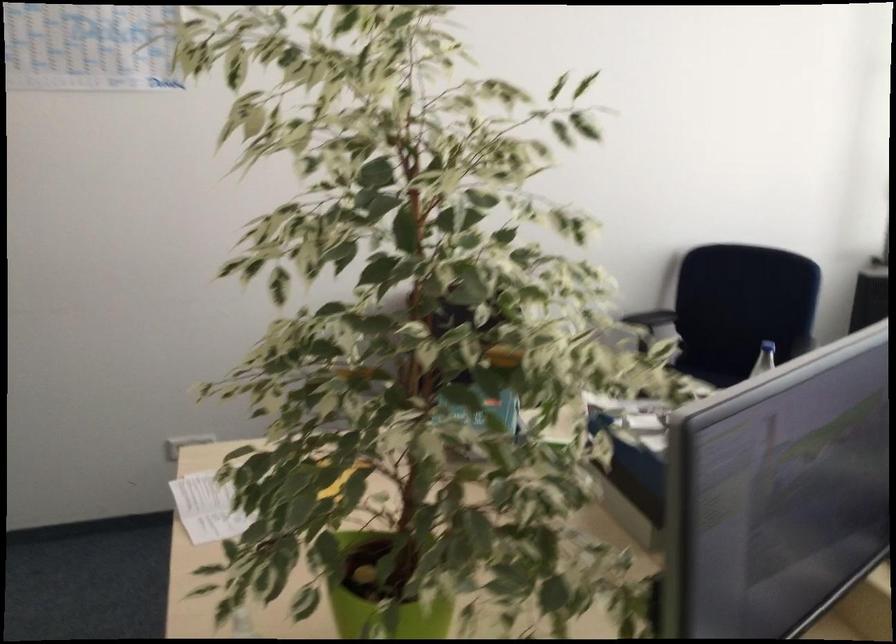
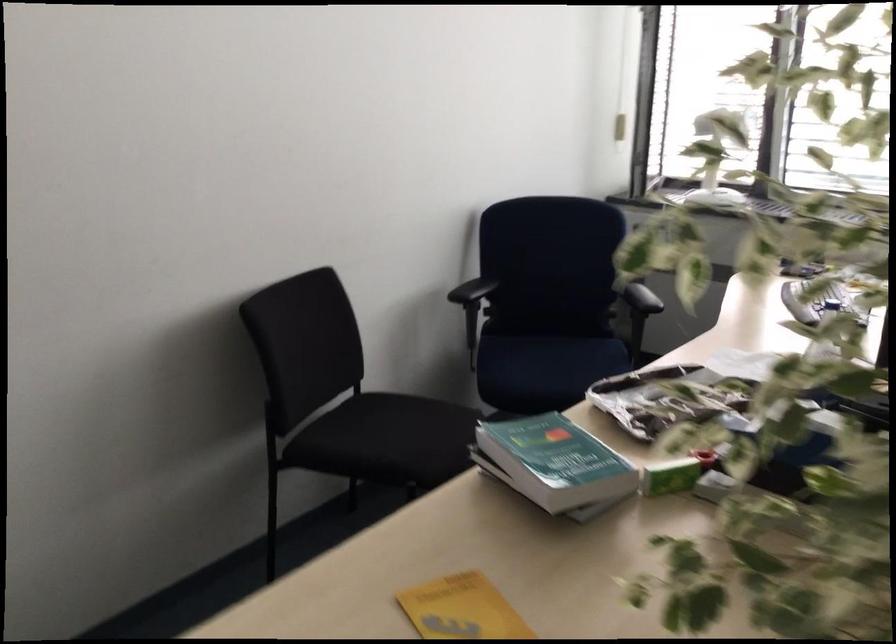
In the second image, find the point that corresponds to pixel 298 352 in the first image.

(847, 480)